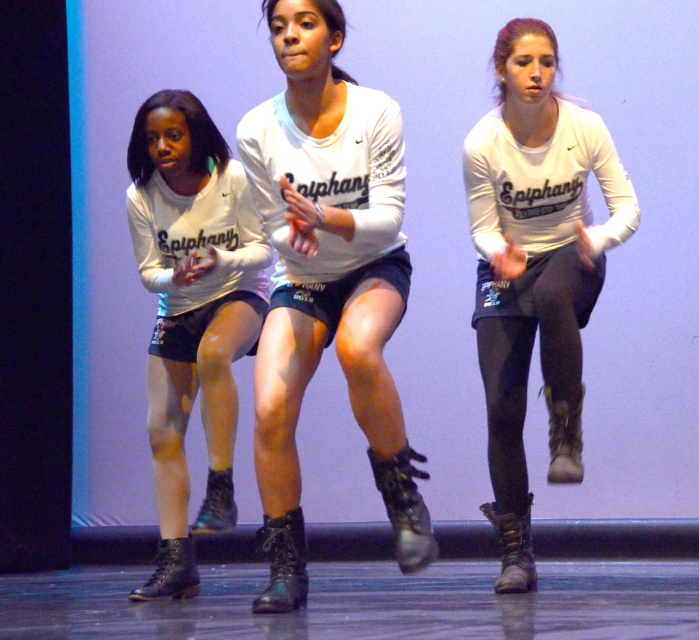
Between matte black shorts at center and matte white shirt at center, which one appears on the right side from the viewer's perspective?

From the viewer's perspective, matte white shirt at center appears more on the right side.

Consider the image. Measure the distance between point (370, 100) and camera.

Point (370, 100) is 3.73 meters away from camera.

Image resolution: width=699 pixels, height=640 pixels. Find the location of `matte black shorts at center`. matte black shorts at center is located at coordinates (326, 282).

This screenshot has height=640, width=699. What do you see at coordinates (326, 282) in the screenshot?
I see `matte black shorts at center` at bounding box center [326, 282].

Who is more distant from viewer, (282, 417) or (229, 360)?

The point (229, 360) is more distant.

Locate an element on the screen. This screenshot has height=640, width=699. matte black shorts at center is located at coordinates (326, 282).

Locate an element on the screen. The height and width of the screenshot is (640, 699). matte black shorts at center is located at coordinates (326, 282).

Consider the image. Does matte white shirt at center appear under matte black boots at center?

Incorrect, matte white shirt at center is not positioned below matte black boots at center.

Does matte white shirt at center have a greater height compared to matte black boots at center?

Yes.

The height and width of the screenshot is (640, 699). In order to click on matte white shirt at center in this screenshot , I will do pos(535,268).